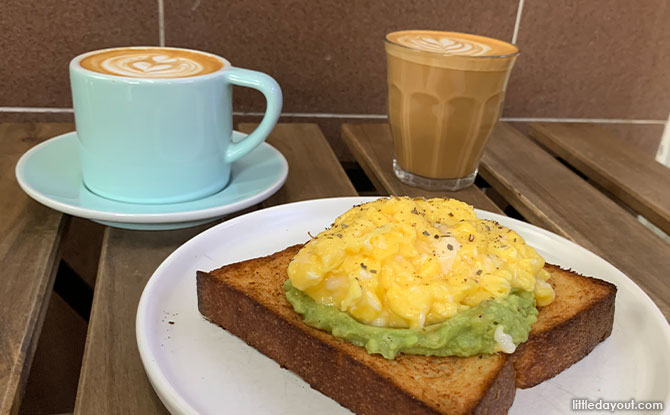
Locate an element on the screen. The width and height of the screenshot is (670, 415). large white plate is located at coordinates (247, 389).